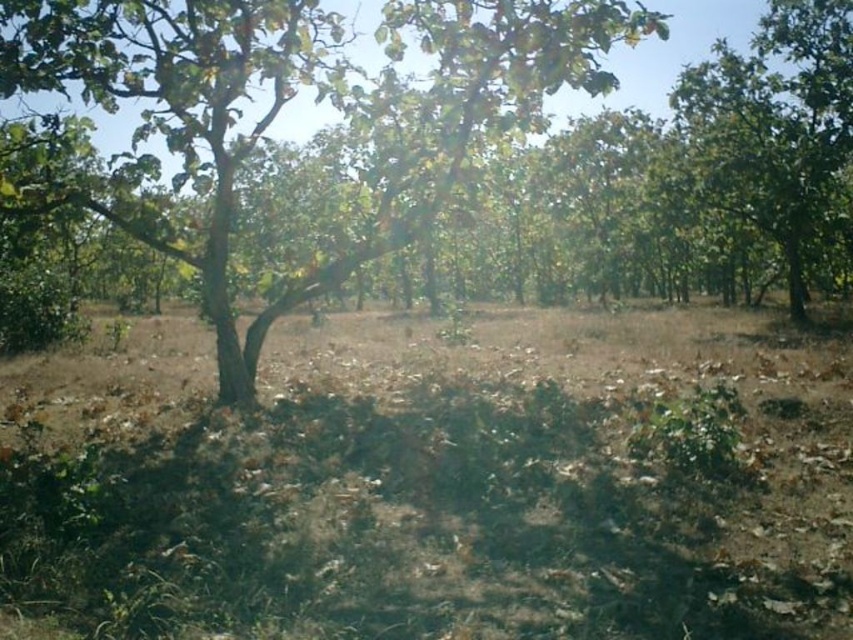
You are an observer standing in the forest looking towards the horizon. You notice two trees, the green leafy tree at center and the green leafy tree at upper right. Which tree is closer to you?

The green leafy tree at center is closer to you because it is positioned under the green leafy tree at upper right, indicating it is in front.

In the scene shown: You are standing in the forest and see two points marked in the image. Which point is nearer to you, point (698,627) or point (225,99)?

Point (698,627) is closer to the camera than point (225,99), so the point nearer to you is point (698,627).